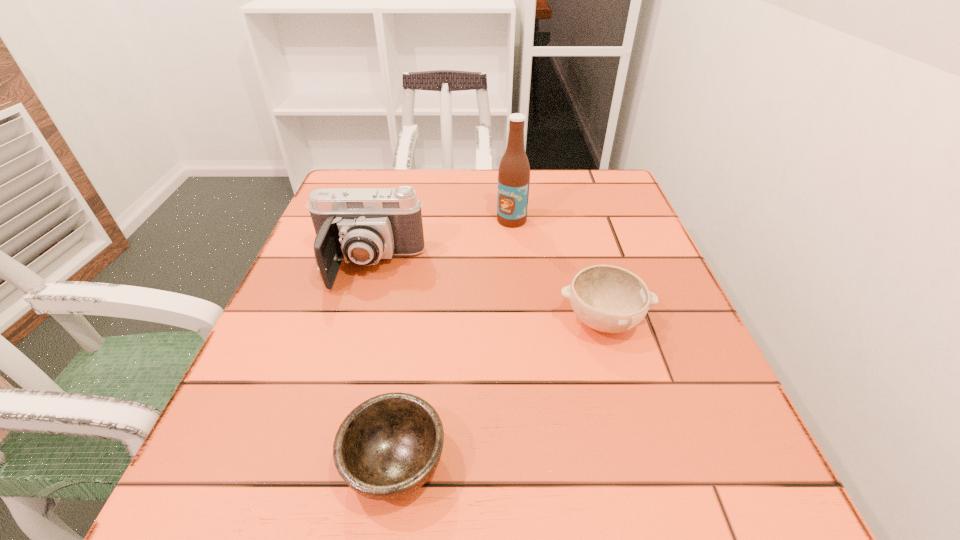
The height and width of the screenshot is (540, 960). In the image, there is a desktop. Identify the location of vacant space at the far left corner. (357, 174).

Locate an element on the screen. free space at the near left corner of the desktop is located at coordinates (237, 492).

This screenshot has height=540, width=960. What are the coordinates of `vacant space at the far right corner` in the screenshot? It's located at (579, 200).

Find the location of `free space at the near right corner of the desktop`. free space at the near right corner of the desktop is located at coordinates (693, 476).

This screenshot has width=960, height=540. Find the location of `free spot between the second object from right to left and the shortest object`. free spot between the second object from right to left and the shortest object is located at coordinates (453, 341).

At what (x,y) coordinates should I click in order to perform the action: click on free area in between the second tallest object and the beer bottle. Please return your answer as a coordinate pair (x, y). The width and height of the screenshot is (960, 540). Looking at the image, I should click on (441, 243).

This screenshot has width=960, height=540. What are the coordinates of `unoccupied area between the third nearest object and the taller bowl` in the screenshot? It's located at tap(486, 294).

Locate an element on the screen. The width and height of the screenshot is (960, 540). vacant area that lies between the third shortest object and the shortest object is located at coordinates (382, 365).

Locate an element on the screen. empty location between the taller bowl and the second object from right to left is located at coordinates (558, 271).

The height and width of the screenshot is (540, 960). What are the coordinates of `free space between the right bowl and the second tallest object` in the screenshot? It's located at (486, 294).